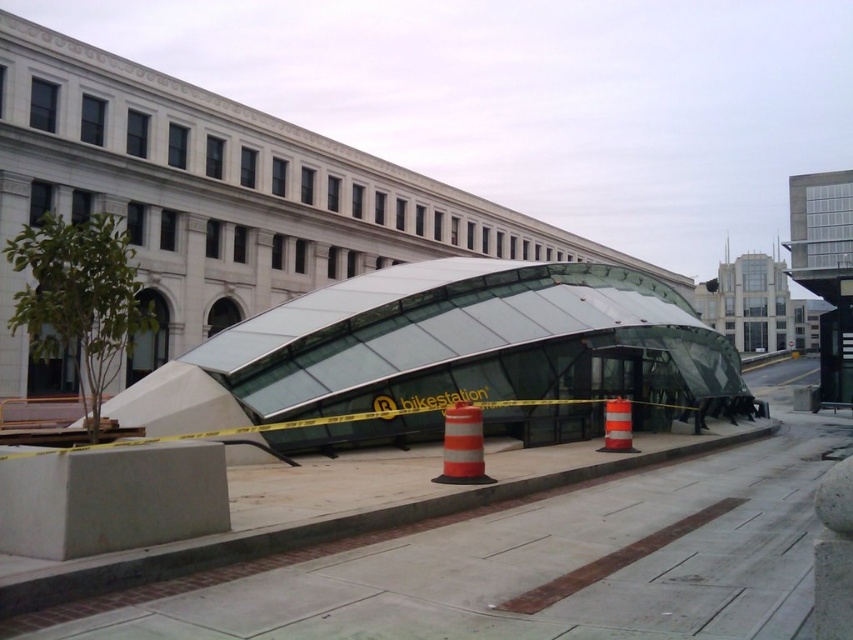
Question: Estimate the real-world distances between objects in this image. Which object is farther from the concrete at center?

Choices:
 (A) orange reflective traffic cone at center
 (B) orange reflective cone at center

Answer: (A)

Question: Which point is farther to the camera?

Choices:
 (A) concrete at center
 (B) orange reflective cone at center

Answer: (B)

Question: Is concrete at center above orange reflective cone at center?

Choices:
 (A) yes
 (B) no

Answer: (B)

Question: Is orange reflective cone at center smaller than orange reflective traffic cone at center?

Choices:
 (A) yes
 (B) no

Answer: (A)

Question: Which point is closer to the camera taking this photo?

Choices:
 (A) (630, 412)
 (B) (461, 424)

Answer: (B)

Question: Does orange reflective cone at center appear on the right side of orange reflective traffic cone at center?

Choices:
 (A) no
 (B) yes

Answer: (A)